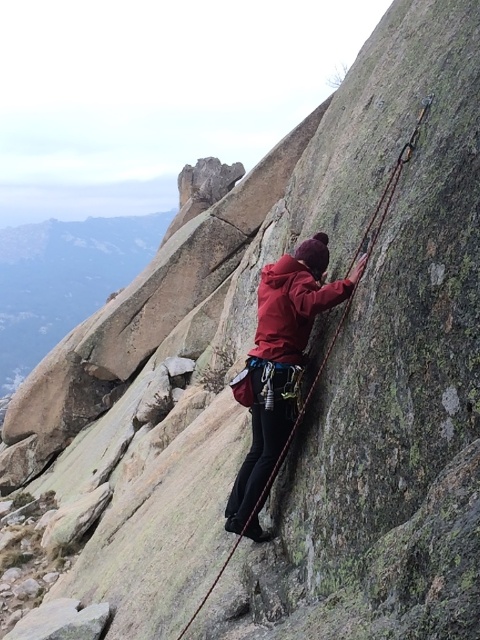
How distant is matte red jacket at center from rope at center?

matte red jacket at center and rope at center are 7.76 feet apart.

Is matte red jacket at center shorter than rope at center?

Indeed, matte red jacket at center has a lesser height compared to rope at center.

This screenshot has height=640, width=480. In order to click on matte red jacket at center in this screenshot , I will do `click(279, 360)`.

Find the location of a particular element. matte red jacket at center is located at coordinates (279, 360).